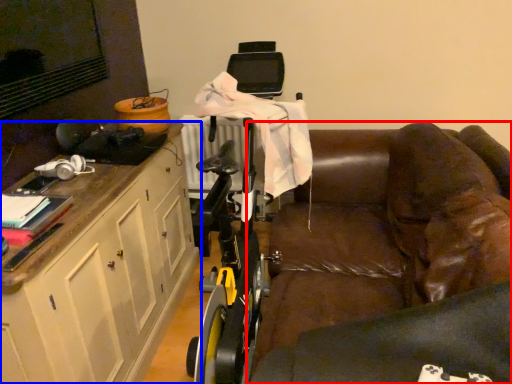
Question: Which object appears closest to the camera in this image, studio couch (highlighted by a red box) or cabinetry (highlighted by a blue box)?

Choices:
 (A) studio couch
 (B) cabinetry

Answer: (A)